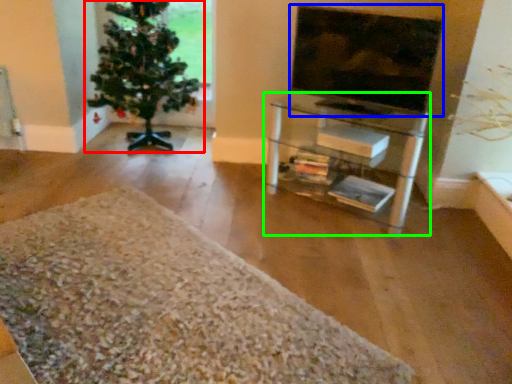
Question: Considering the real-world distances, which object is farthest from houseplant (highlighted by a red box)? television (highlighted by a blue box) or shelf (highlighted by a green box)?

Choices:
 (A) television
 (B) shelf

Answer: (A)